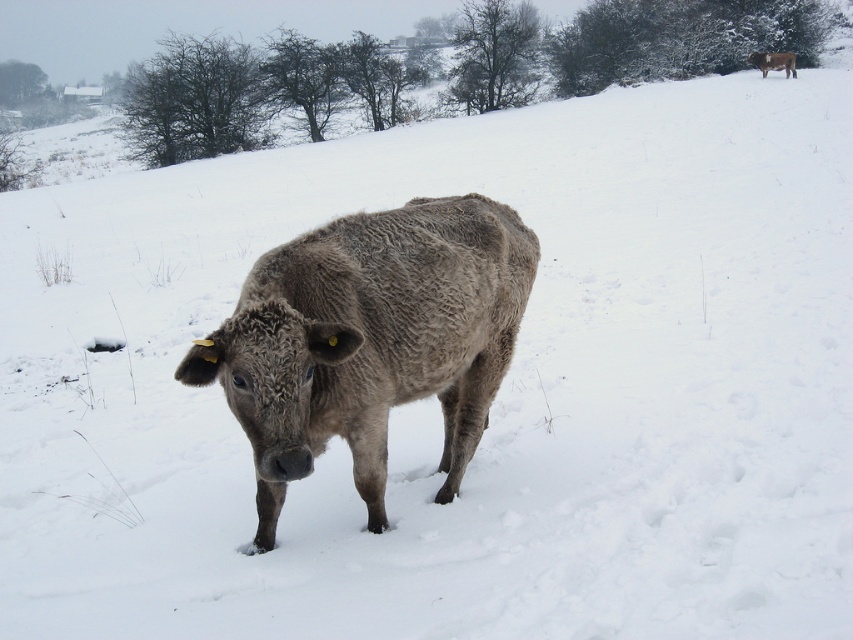
You are a photographer trying to capture both the gray woolly bison at center and the gray woolly cow at upper right in a single frame. Which animal will appear larger in your photo?

The gray woolly bison at center will appear larger in the photo because it is closer to the viewer than the gray woolly cow at upper right.

You are a farmer checking your herd in the snow field. You notice the gray woolly bison at center and the gray woolly cow at upper right. Which animal is taller?

The gray woolly bison at center is taller than the gray woolly cow at upper right.